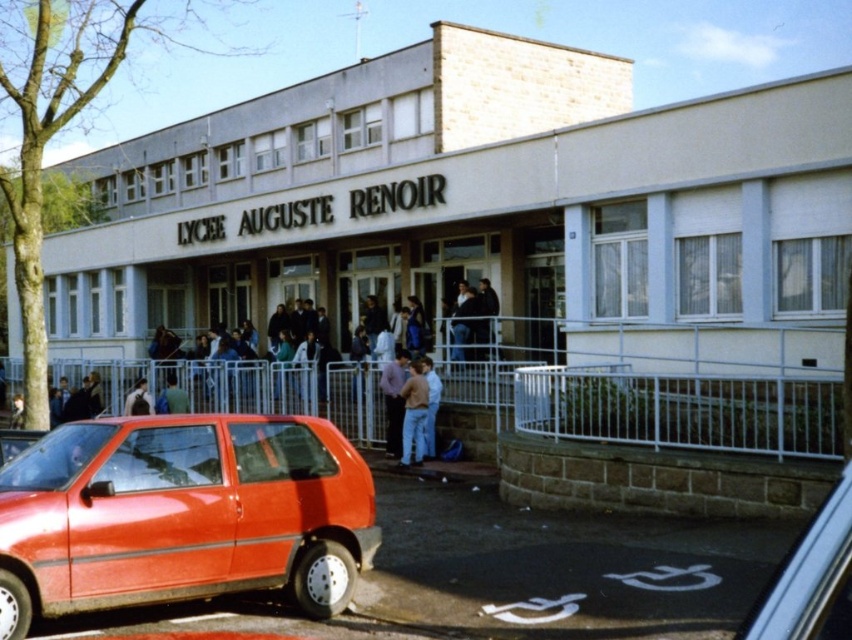
Question: Does shiny red hatchback at lower left appear on the right side of metallic red car at lower right?

Choices:
 (A) no
 (B) yes

Answer: (A)

Question: Based on their relative distances, which object is farther from the light blue jeans at center?

Choices:
 (A) metallic red car at lower right
 (B) shiny red hatchback at lower left

Answer: (A)

Question: Which point is closer to the camera taking this photo?

Choices:
 (A) (42, 534)
 (B) (822, 566)
 (C) (406, 390)

Answer: (B)

Question: Where is shiny red hatchback at lower left located in relation to metallic red car at lower right in the image?

Choices:
 (A) left
 (B) right

Answer: (A)

Question: Is shiny red hatchback at lower left wider than metallic red car at lower right?

Choices:
 (A) yes
 (B) no

Answer: (A)

Question: Which of these objects is positioned farthest from the shiny red hatchback at lower left?

Choices:
 (A) light blue jeans at center
 (B) metallic red car at lower right

Answer: (A)